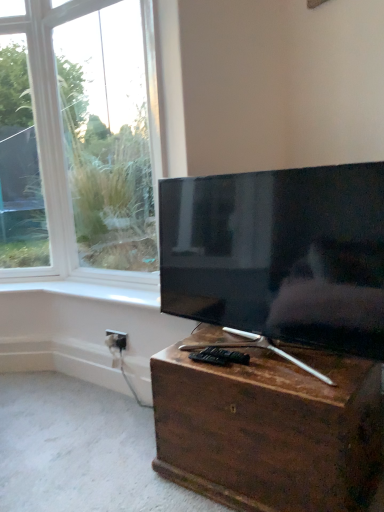
Question: From the image's perspective, would you say white glossy window sill at upper center is shown under white plastic electric outlet at lower center?

Choices:
 (A) no
 (B) yes

Answer: (A)

Question: Considering the relative sizes of white glossy window sill at upper center and white plastic electric outlet at lower center in the image provided, is white glossy window sill at upper center taller than white plastic electric outlet at lower center?

Choices:
 (A) yes
 (B) no

Answer: (B)

Question: Is white glossy window sill at upper center completely or partially outside of white plastic electric outlet at lower center?

Choices:
 (A) yes
 (B) no

Answer: (A)

Question: Can you confirm if white glossy window sill at upper center is wider than white plastic electric outlet at lower center?

Choices:
 (A) yes
 (B) no

Answer: (A)

Question: From the image's perspective, is white glossy window sill at upper center located above white plastic electric outlet at lower center?

Choices:
 (A) no
 (B) yes

Answer: (B)

Question: Is matte black tv at center taller or shorter than white plastic electric outlet at lower center?

Choices:
 (A) tall
 (B) short

Answer: (A)

Question: Is matte black tv at center in front of or behind white plastic electric outlet at lower center in the image?

Choices:
 (A) front
 (B) behind

Answer: (A)

Question: Would you say matte black tv at center is to the left or to the right of white plastic electric outlet at lower center in the picture?

Choices:
 (A) left
 (B) right

Answer: (B)

Question: Is point (301, 188) positioned closer to the camera than point (107, 330)?

Choices:
 (A) closer
 (B) farther

Answer: (A)

Question: Is white plastic electric outlet at lower center to the left or to the right of white glossy window sill at upper center in the image?

Choices:
 (A) right
 (B) left

Answer: (A)

Question: Considering the positions of white plastic electric outlet at lower center and white glossy window sill at upper center in the image, is white plastic electric outlet at lower center wider or thinner than white glossy window sill at upper center?

Choices:
 (A) wide
 (B) thin

Answer: (B)

Question: Considering their positions, is white plastic electric outlet at lower center located in front of or behind white glossy window sill at upper center?

Choices:
 (A) front
 (B) behind

Answer: (B)

Question: From a real-world perspective, is white plastic electric outlet at lower center physically located above or below white glossy window sill at upper center?

Choices:
 (A) above
 (B) below

Answer: (B)

Question: Would you say brown wooden chest at lower center is to the left or to the right of white plastic electric outlet at lower center in the picture?

Choices:
 (A) left
 (B) right

Answer: (B)

Question: From the image's perspective, is brown wooden chest at lower center positioned above or below white plastic electric outlet at lower center?

Choices:
 (A) above
 (B) below

Answer: (B)